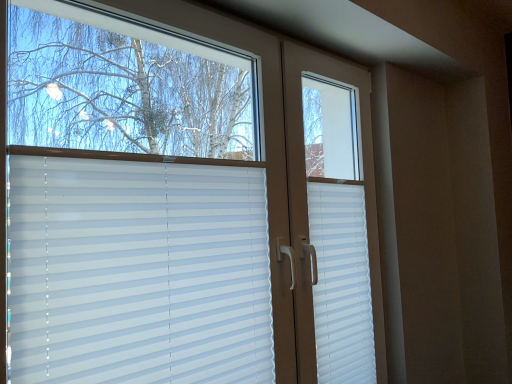
Question: From a real-world perspective, is white plastic blinds at center positioned above or below white plastic shutter at right?

Choices:
 (A) above
 (B) below

Answer: (A)

Question: Do you think white plastic blinds at center is within white plastic shutter at right, or outside of it?

Choices:
 (A) outside
 (B) inside

Answer: (A)

Question: Which is nearer to the white plastic blinds at center?

Choices:
 (A) white plastic shutter at right
 (B) white plastic blinds at center

Answer: (B)

Question: Based on their relative distances, which object is nearer to the white plastic blinds at center?

Choices:
 (A) white plastic shutter at right
 (B) white plastic blinds at center

Answer: (B)